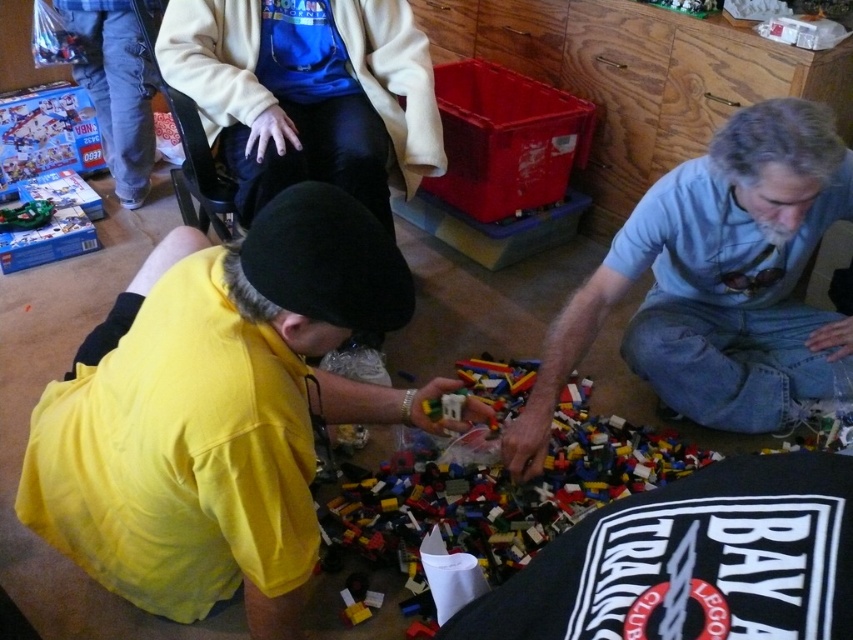
Is gray hair man at lower right below multicolored plastic bricks at center?

Incorrect, gray hair man at lower right is not positioned below multicolored plastic bricks at center.

Between gray hair man at lower right and multicolored plastic bricks at center, which one appears on the left side from the viewer's perspective?

multicolored plastic bricks at center is more to the left.

Which is behind, point (570, 300) or point (485, 474)?

Positioned behind is point (570, 300).

Where is `gray hair man at lower right`? The height and width of the screenshot is (640, 853). gray hair man at lower right is located at coordinates (715, 280).

Does yellow matte shirt at lower left have a lesser height compared to gray hair man at lower right?

No, yellow matte shirt at lower left is not shorter than gray hair man at lower right.

Does point (250, 500) come behind point (799, 168)?

No, it is in front of (799, 168).

Who is more distant from viewer, (236,360) or (735,196)?

The point (735,196) is behind.

The width and height of the screenshot is (853, 640). Find the location of `yellow matte shirt at lower left`. yellow matte shirt at lower left is located at coordinates (219, 413).

Which is more to the right, yellow matte shirt at lower left or black fabric shirt at lower right?

black fabric shirt at lower right

What do you see at coordinates (219, 413) in the screenshot?
I see `yellow matte shirt at lower left` at bounding box center [219, 413].

Find the location of a particular element. The height and width of the screenshot is (640, 853). yellow matte shirt at lower left is located at coordinates (219, 413).